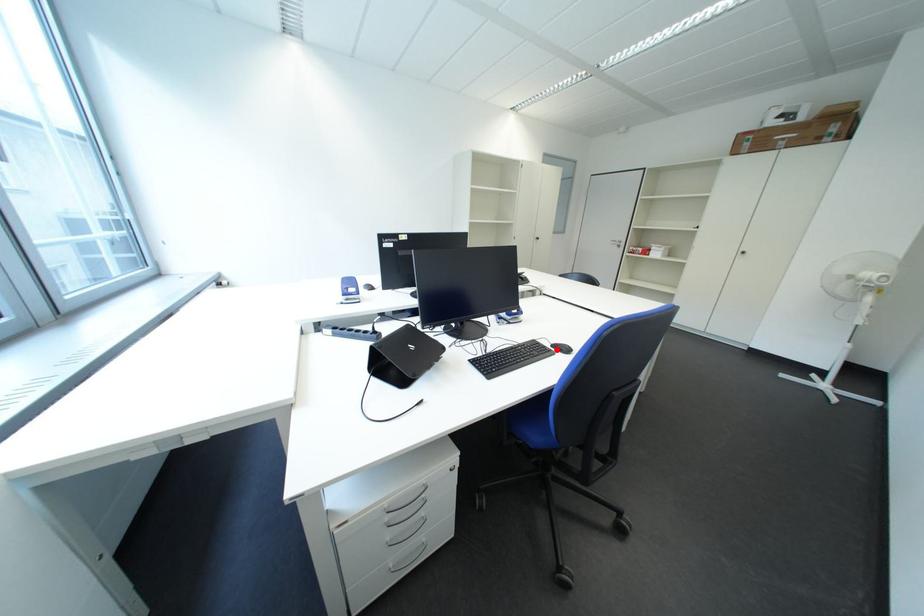
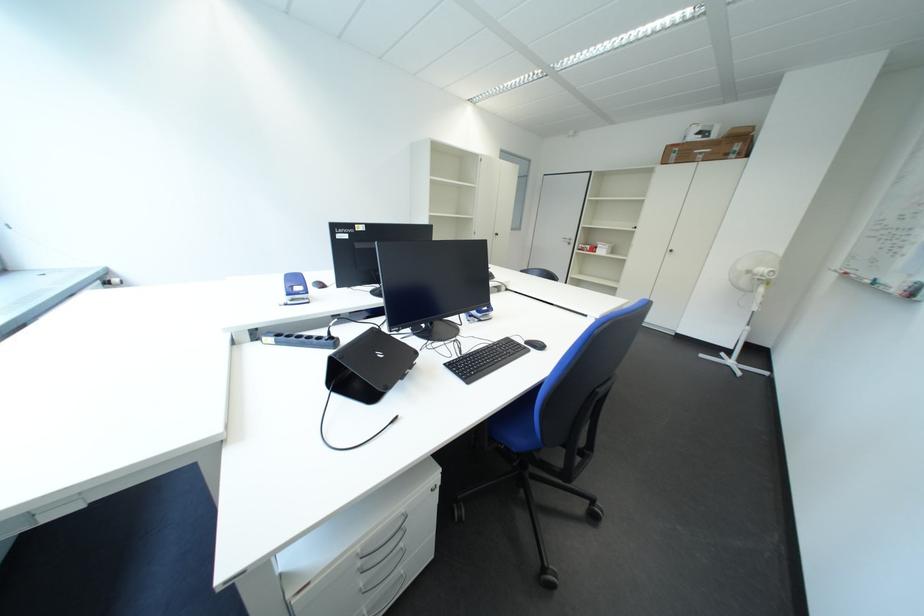
Where in the second image is the point corresponding to the highlighted location from the first image?

(531, 347)